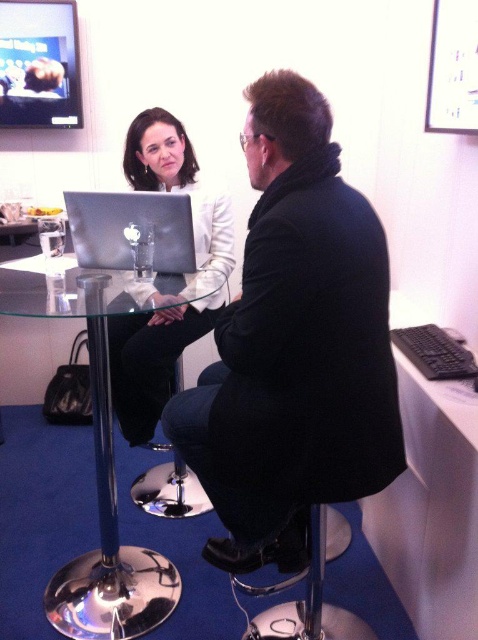
Between black matte coat at center and dark blue fabric bar stool at center, which one has less height?

dark blue fabric bar stool at center is shorter.

Which of these two, black matte coat at center or dark blue fabric bar stool at center, stands taller?

black matte coat at center

Who is more forward, (x=270, y=417) or (x=159, y=465)?

Point (x=270, y=417)

Where is `black matte coat at center`? black matte coat at center is located at coordinates (294, 346).

Can you confirm if transparent glass table at center is thinner than satin silver laptop at center?

No.

Does transparent glass table at center have a larger size compared to satin silver laptop at center?

Yes.

Who is more distant from viewer, (85, 275) or (183, 268)?

Point (183, 268)

The width and height of the screenshot is (478, 640). I want to click on transparent glass table at center, so click(x=96, y=472).

Describe the element at coordinates (152, 284) in the screenshot. I see `white matte jacket at center` at that location.

Does point (203, 301) come behind point (169, 508)?

No, (203, 301) is in front of (169, 508).

Locate an element on the screen. This screenshot has height=640, width=478. white matte jacket at center is located at coordinates (152, 284).